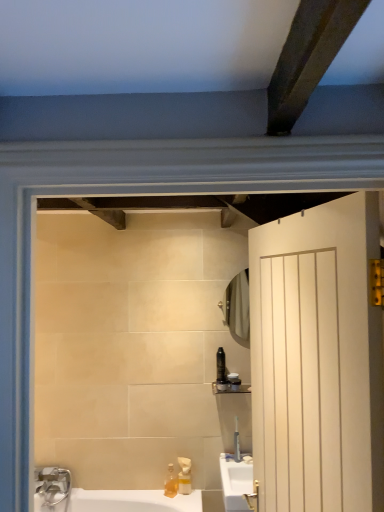
Question: Which direction should I rotate to look at translucent plastic bottle at upper center, placed as the second toiletry when sorted from bottom to top?

Choices:
 (A) right
 (B) left

Answer: (A)

Question: Does matte black container at upper right, which is the 3th toiletry from bottom to top, have a greater width compared to clear plastic tube at upper center, positioned as the fourth toiletry in top-to-bottom order?

Choices:
 (A) yes
 (B) no

Answer: (A)

Question: Does matte black container at upper right, the 2th toiletry in the top-to-bottom sequence, appear on the left side of clear plastic tube at upper center, positioned as the fourth toiletry in top-to-bottom order?

Choices:
 (A) yes
 (B) no

Answer: (A)

Question: Is matte black container at upper right, which is the 3th toiletry from bottom to top, located outside clear plastic tube at upper center, which ranks as the first toiletry in bottom-to-top order?

Choices:
 (A) no
 (B) yes

Answer: (B)

Question: From a real-world perspective, is matte black container at upper right, which is the 3th toiletry from bottom to top, beneath clear plastic tube at upper center, which ranks as the first toiletry in bottom-to-top order?

Choices:
 (A) no
 (B) yes

Answer: (A)

Question: Is matte black container at upper right, the 2th toiletry in the top-to-bottom sequence, closer to camera compared to clear plastic tube at upper center, positioned as the fourth toiletry in top-to-bottom order?

Choices:
 (A) no
 (B) yes

Answer: (A)

Question: Considering the relative sizes of matte black container at upper right, which is the 3th toiletry from bottom to top, and clear plastic tube at upper center, which ranks as the first toiletry in bottom-to-top order, in the image provided, is matte black container at upper right, which is the 3th toiletry from bottom to top, smaller than clear plastic tube at upper center, which ranks as the first toiletry in bottom-to-top order,?

Choices:
 (A) yes
 (B) no

Answer: (B)

Question: Could you tell me if matte black shelf at upper center is turned towards matte black container at upper right, which is the 3th toiletry from bottom to top?

Choices:
 (A) no
 (B) yes

Answer: (A)

Question: Is the position of matte black shelf at upper center less distant than that of matte black container at upper right, which is the 3th toiletry from bottom to top?

Choices:
 (A) yes
 (B) no

Answer: (A)

Question: Is matte black container at upper right, which is the 3th toiletry from bottom to top, at the back of matte black shelf at upper center?

Choices:
 (A) no
 (B) yes

Answer: (B)

Question: Considering the relative sizes of matte black shelf at upper center and matte black container at upper right, the 2th toiletry in the top-to-bottom sequence, in the image provided, is matte black shelf at upper center taller than matte black container at upper right, the 2th toiletry in the top-to-bottom sequence,?

Choices:
 (A) yes
 (B) no

Answer: (B)

Question: Does matte black shelf at upper center have a smaller size compared to matte black container at upper right, the 2th toiletry in the top-to-bottom sequence?

Choices:
 (A) yes
 (B) no

Answer: (B)

Question: Is matte black shelf at upper center at the right side of matte black container at upper right, the 2th toiletry in the top-to-bottom sequence?

Choices:
 (A) yes
 (B) no

Answer: (B)

Question: Does translucent plastic soap dispenser at lower center, arranged as the 2th soap dispenser when viewed from the right, appear on the right side of matte black shelf at upper center?

Choices:
 (A) no
 (B) yes

Answer: (A)